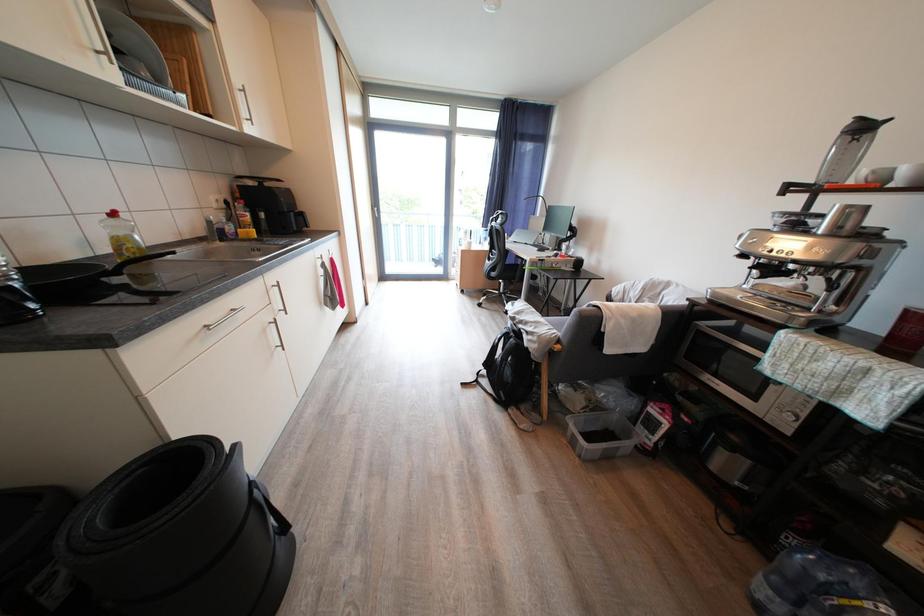
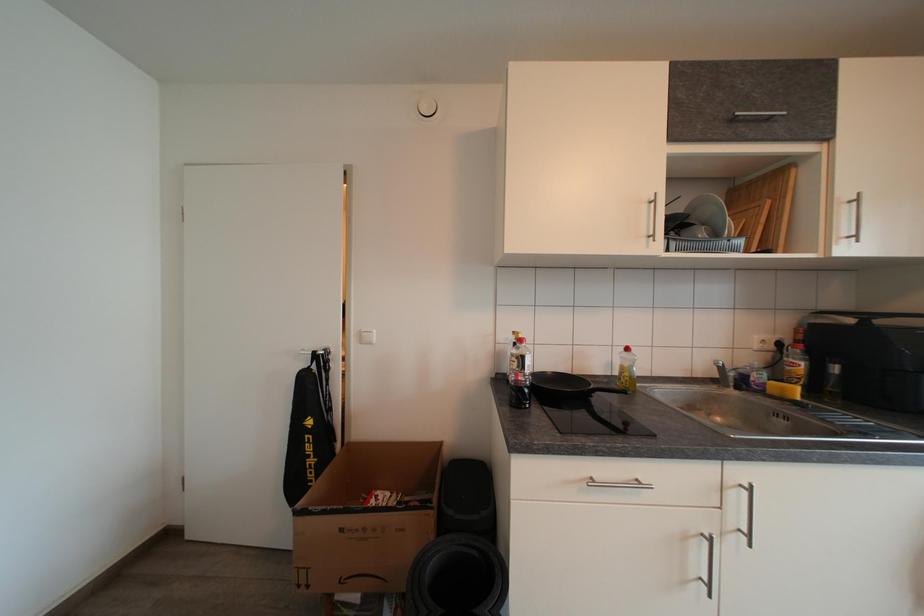
Question: How did the camera likely rotate?

Choices:
 (A) Left
 (B) Right
 (C) Up
 (D) Down

Answer: (A)